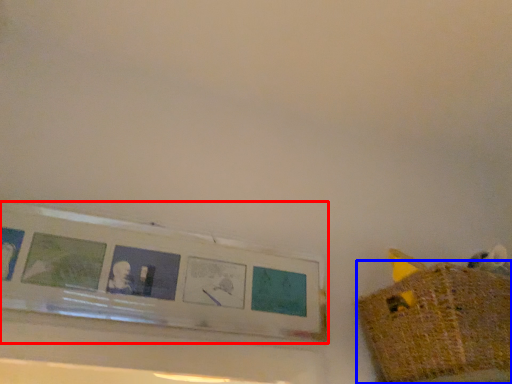
Question: Which object is further to the camera taking this photo, picture frame (highlighted by a red box) or basket (highlighted by a blue box)?

Choices:
 (A) picture frame
 (B) basket

Answer: (A)